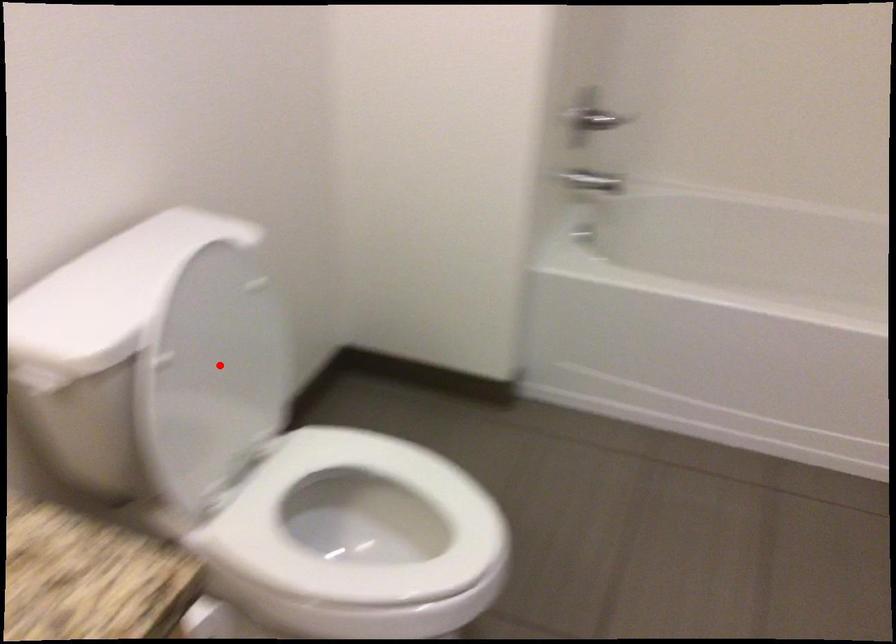
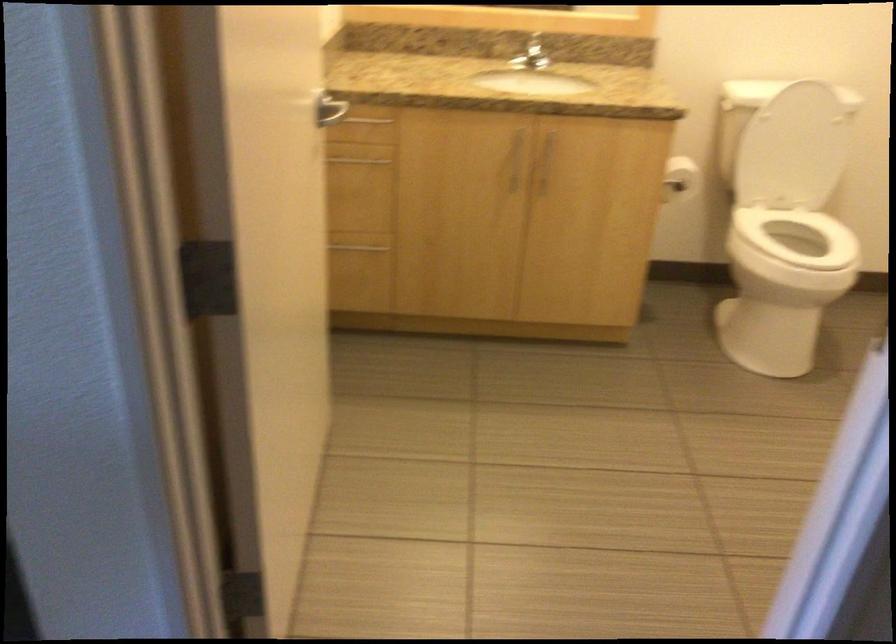
Question: I am providing you with two images of the same scene from different viewpoints. Given a red point in image1, look at the same physical point in image2. Is it:

Choices:
 (A) Closer to the viewpoint
 (B) Farther from the viewpoint

Answer: (B)